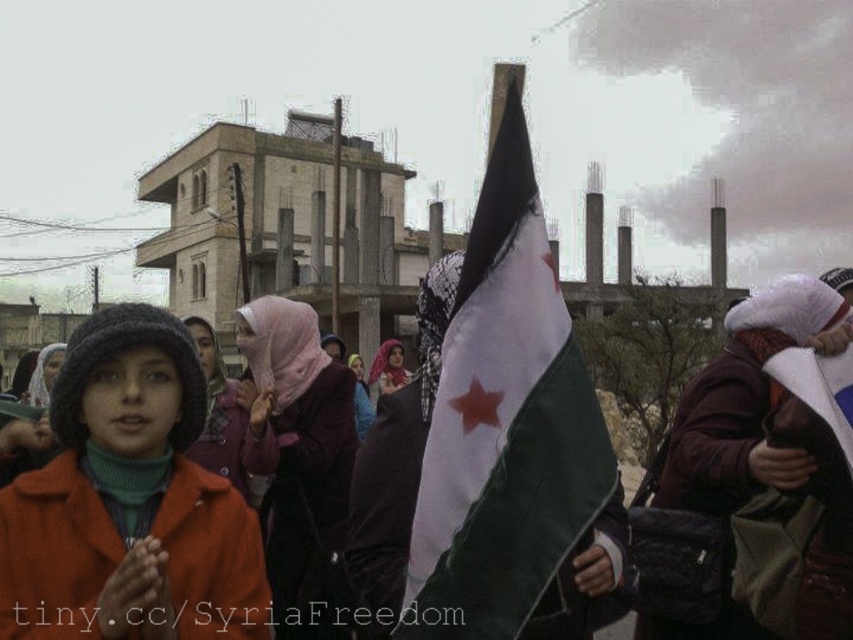
Does pink fabric headscarf at center appear on the right side of matte pink scarf at center?

Incorrect, pink fabric headscarf at center is not on the right side of matte pink scarf at center.

Is pink fabric headscarf at center smaller than matte pink scarf at center?

Correct, pink fabric headscarf at center occupies less space than matte pink scarf at center.

Is point (309, 387) closer to camera compared to point (373, 378)?

Yes.

Locate an element on the screen. pink fabric headscarf at center is located at coordinates (300, 460).

Is white fabric flag at center to the right of matte pink scarf at center from the viewer's perspective?

Indeed, white fabric flag at center is positioned on the right side of matte pink scarf at center.

Is point (438, 576) closer to camera compared to point (370, 378)?

Yes, point (438, 576) is closer to viewer.

You are a GUI agent. You are given a task and a screenshot of the screen. Output one action in this format:
    pyautogui.click(x=<x>, y=<y>)
    Task: Click on the white fabric flag at center
    The height and width of the screenshot is (640, 853).
    Given the screenshot: What is the action you would take?
    pyautogui.click(x=503, y=424)

Is white fabric flag at center below pink fabric headscarf at center?

Actually, white fabric flag at center is above pink fabric headscarf at center.

Is white fabric flag at center bigger than pink fabric headscarf at center?

No.

This screenshot has width=853, height=640. Find the location of `white fabric flag at center`. white fabric flag at center is located at coordinates (503, 424).